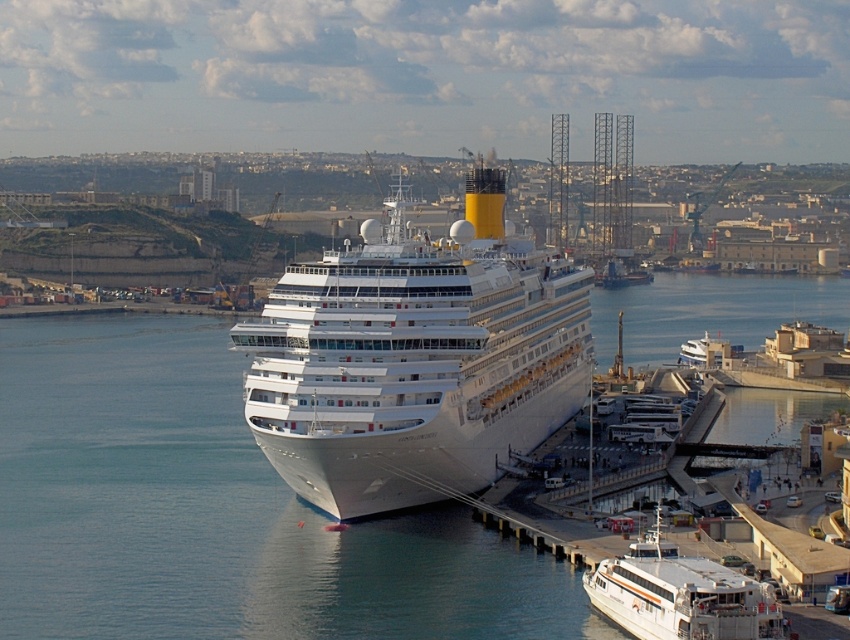
Question: Does clear blue water at center appear over white glossy ferry at lower right?

Choices:
 (A) yes
 (B) no

Answer: (A)

Question: Can you confirm if clear blue water at center is smaller than white glossy cruise ship at center?

Choices:
 (A) yes
 (B) no

Answer: (B)

Question: Observing the image, what is the correct spatial positioning of clear blue water at center in reference to white glossy ferry at lower right?

Choices:
 (A) left
 (B) right

Answer: (A)

Question: Which object appears closest to the camera in this image?

Choices:
 (A) clear blue water at center
 (B) white glossy cruise ship at center

Answer: (A)

Question: Which of the following is the closest to the observer?

Choices:
 (A) (191, 340)
 (B) (412, 273)
 (C) (653, 568)

Answer: (C)

Question: Which of these objects is positioned farthest from the clear blue water at center?

Choices:
 (A) white glossy cruise ship at center
 (B) white glossy ferry at lower right

Answer: (B)